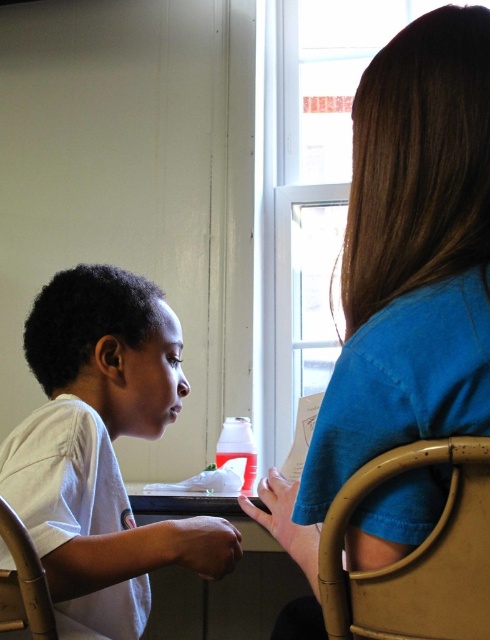
You are standing in the room and want to determine which object is bigger between the blue cotton shirt at upper right and the wooden chair at lower right. Based on the scene, which one is larger?

The blue cotton shirt at upper right has a larger size compared to the wooden chair at lower right, so the blue cotton shirt at upper right is bigger.

Consider the image. You are standing in the room and want to reach the point marked as point [473,541]. If your arm can reach 28 inches, can you touch that point without moving your feet?

The distance between point [473,541] and the viewer is 28.73 inches. Since your arm can only reach 28 inches, you cannot touch the point without moving your feet.